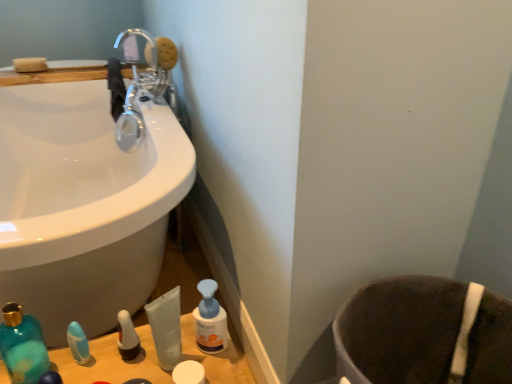
Find the location of `blank area to the left of white matte container at lower center, the 4th toiletry when ordered from left to right`. blank area to the left of white matte container at lower center, the 4th toiletry when ordered from left to right is located at coordinates (123, 364).